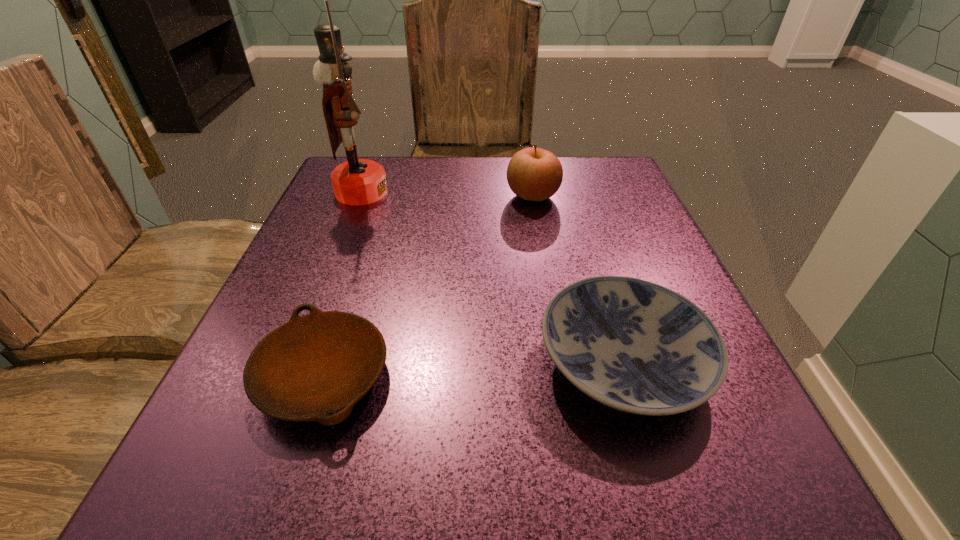
Identify the location of vacant area that satisfies the following two spatial constraints: 1. on the front-facing side of the nutcracker; 2. on the right side of the apple. click(360, 196).

I want to click on vacant point that satisfies the following two spatial constraints: 1. on the front-facing side of the right plate; 2. on the right side of the tallest object, so pyautogui.click(x=295, y=362).